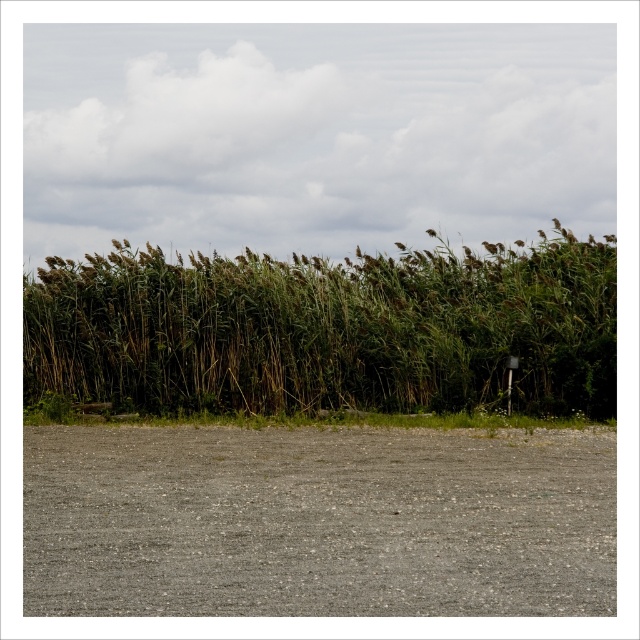
In the scene shown: You are a gardener who needs to plant a new flower bed. You have two areas to choose from in the image. Which area has a larger surface area for planting? The gray gravelly dirt field at lower center or the green grassy reeds at upper center?

The green grassy reeds at upper center has a larger surface area for planting than the gray gravelly dirt field at lower center.

You are standing at the center of the image. Which direction should you walk to reach the gray gravelly dirt field at lower center?

You should walk towards the lower center direction to reach the gray gravelly dirt field at lower center.